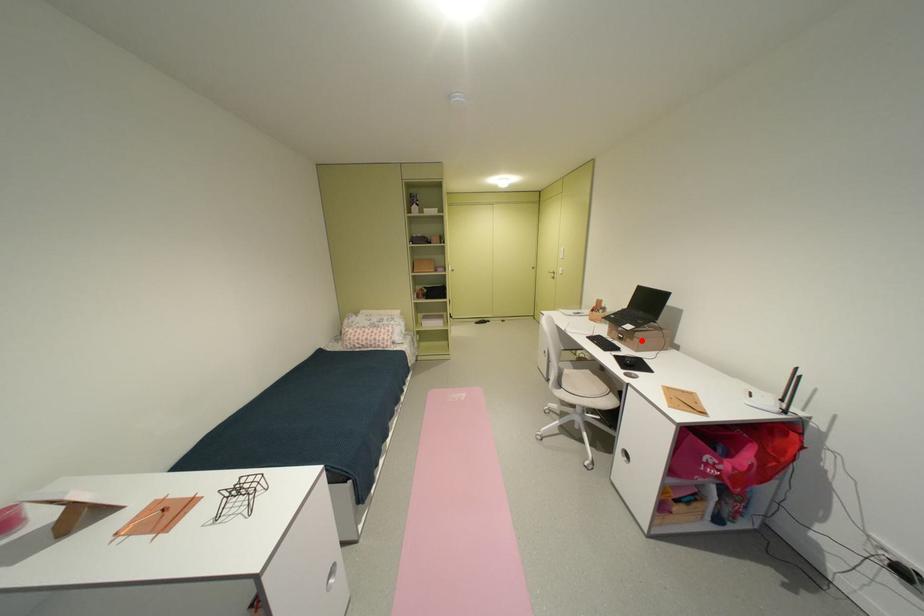
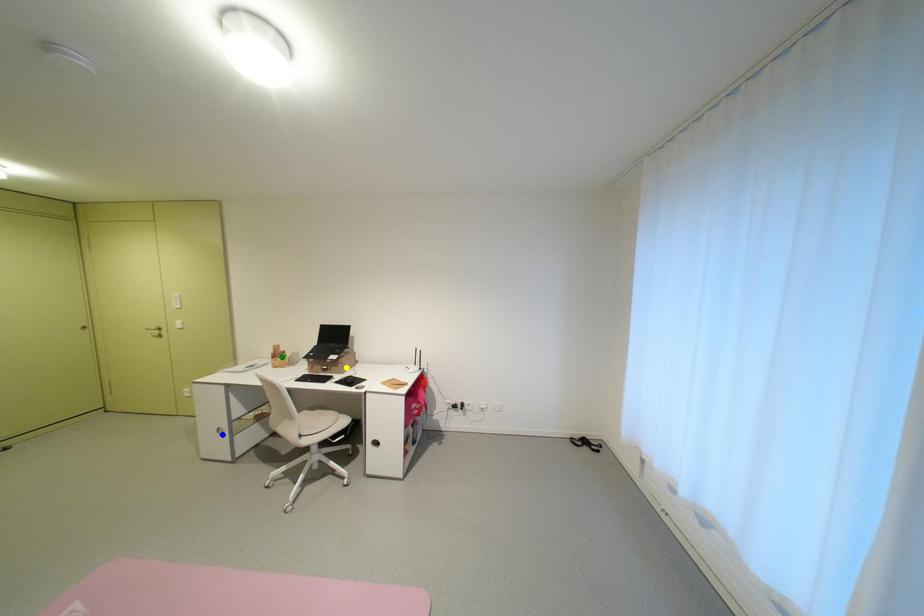
Question: I am providing you with two images of the same scene from different viewpoints. A red point is marked on the first image. You are given multiple points on the second image. Can you choose the point in image 2 that corresponds to the point in image 1?

Choices:
 (A) blue point
 (B) green point
 (C) yellow point

Answer: (C)